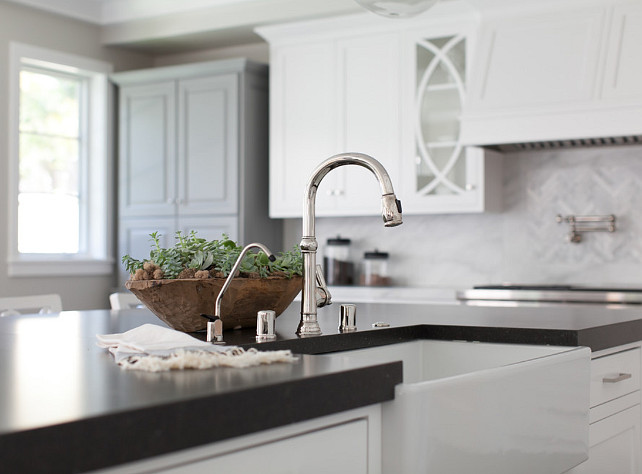
Where is `hand towel`? This screenshot has width=642, height=474. hand towel is located at coordinates (180, 349).